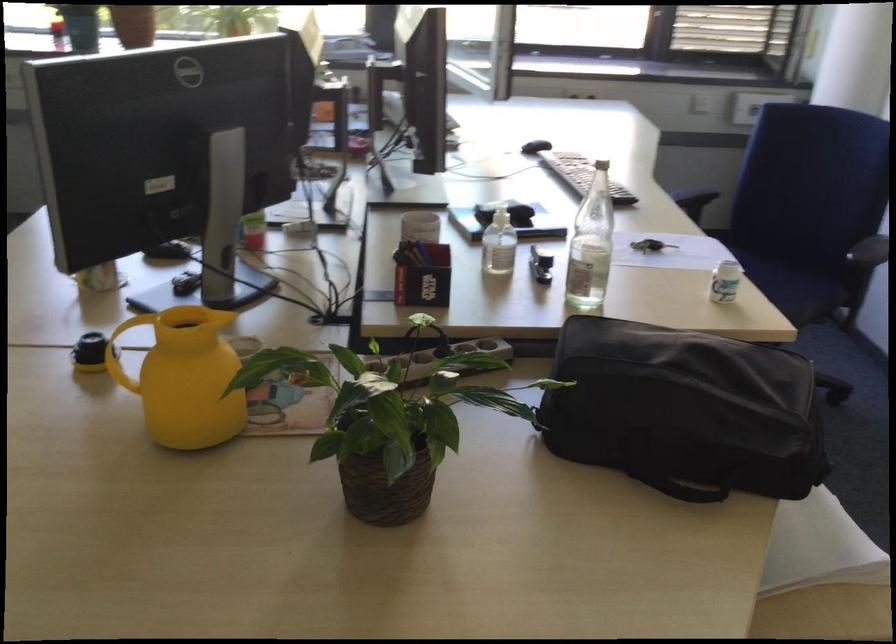
Find where to lift the set of keys. Please return your answer as a coordinate pair (x, y).

(651, 245)